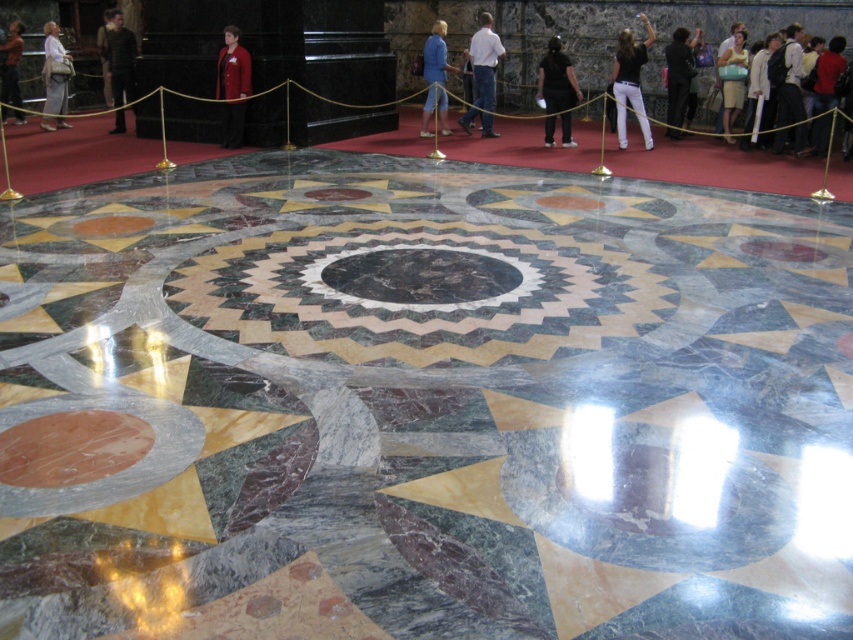
Question: Is matte red coat at center thinner than dark gray suit at upper left?

Choices:
 (A) yes
 (B) no

Answer: (A)

Question: Which point appears closest to the camera in this image?

Choices:
 (A) (433, 35)
 (B) (483, 44)
 (C) (685, 104)
 (D) (799, 38)

Answer: (D)

Question: Can you confirm if matte black shirt at upper right is wider than blue velvet coat at center?

Choices:
 (A) yes
 (B) no

Answer: (A)

Question: Does matte red coat at center have a smaller size compared to white cotton shirt at upper right?

Choices:
 (A) yes
 (B) no

Answer: (B)

Question: Which of the following is the closest to the observer?

Choices:
 (A) (798, 33)
 (B) (677, 97)

Answer: (A)

Question: Which point is farther to the camera?

Choices:
 (A) blue velvet coat at center
 (B) matte gray backpack at left
 (C) matte red coat at center
 (D) white cotton shirt at center

Answer: (B)